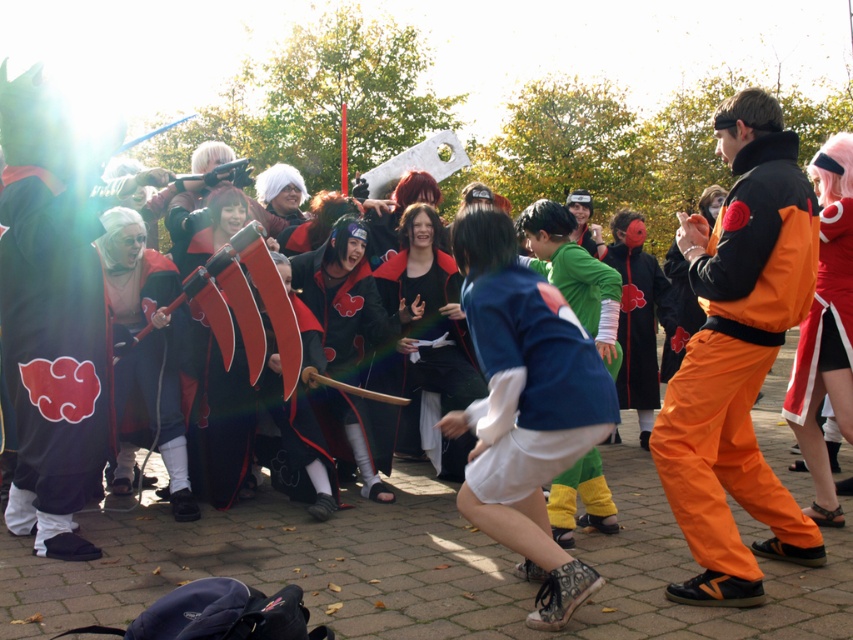
Question: Which object appears farthest from the camera in this image?

Choices:
 (A) white cotton shirt at center
 (B) orange cotton pants at right

Answer: (B)

Question: Which of the following is the farthest from the observer?

Choices:
 (A) (769, 122)
 (B) (561, 390)

Answer: (A)

Question: Is orange cotton pants at right bigger than white cotton shirt at center?

Choices:
 (A) no
 (B) yes

Answer: (B)

Question: Which point is farther from the camera taking this photo?

Choices:
 (A) (491, 474)
 (B) (695, 292)

Answer: (B)

Question: Does orange cotton pants at right have a larger size compared to white cotton shirt at center?

Choices:
 (A) yes
 (B) no

Answer: (A)

Question: Does orange cotton pants at right lie behind white cotton shirt at center?

Choices:
 (A) yes
 (B) no

Answer: (A)